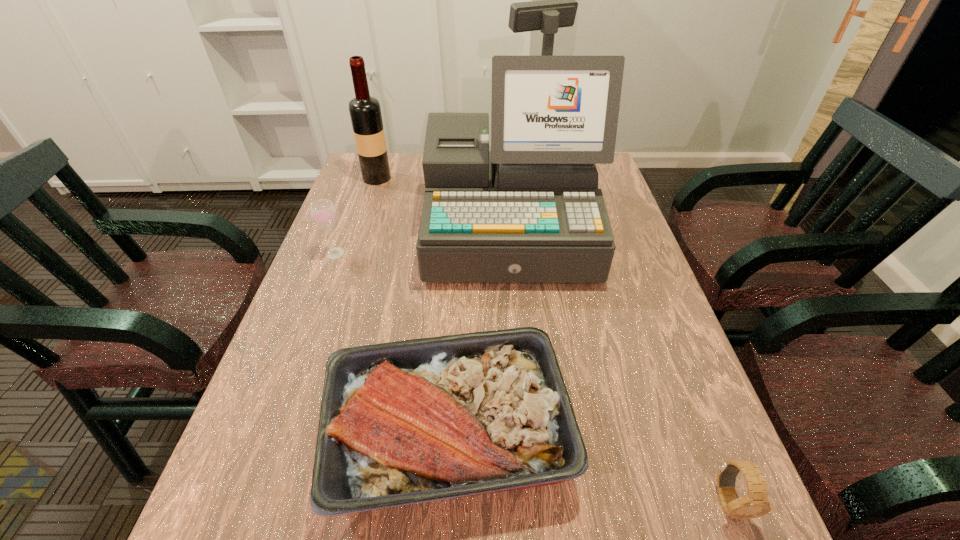
Identify the location of cash register. This screenshot has height=540, width=960. (529, 210).

Where is `wine bottle`? This screenshot has width=960, height=540. wine bottle is located at coordinates (365, 112).

This screenshot has width=960, height=540. What are the coordinates of `wineglass` in the screenshot? It's located at click(x=323, y=212).

Where is `tray`? The image size is (960, 540). tray is located at coordinates (420, 420).

This screenshot has width=960, height=540. I want to click on the shortest object, so click(x=755, y=504).

The image size is (960, 540). I want to click on the rightmost object, so click(755, 504).

Identify the location of vacant space located 0.220m on the customer-facing side of the tallest object. (519, 363).

You are a GUI agent. You are given a task and a screenshot of the screen. Output one action in this format:
    pyautogui.click(x=<x>, y=<y>)
    Task: Click on the vacant space situated 0.120m on the right of the second tallest object
    The height and width of the screenshot is (540, 960).
    Given the screenshot: What is the action you would take?
    pyautogui.click(x=427, y=178)

Image resolution: width=960 pixels, height=540 pixels. I want to click on free space located on the right of the wineglass, so click(x=447, y=253).

At what (x,y) coordinates should I click in order to perform the action: click on vacant space located on the left of the tray. Please return your answer as a coordinate pair (x, y). The height and width of the screenshot is (540, 960). Looking at the image, I should click on (250, 434).